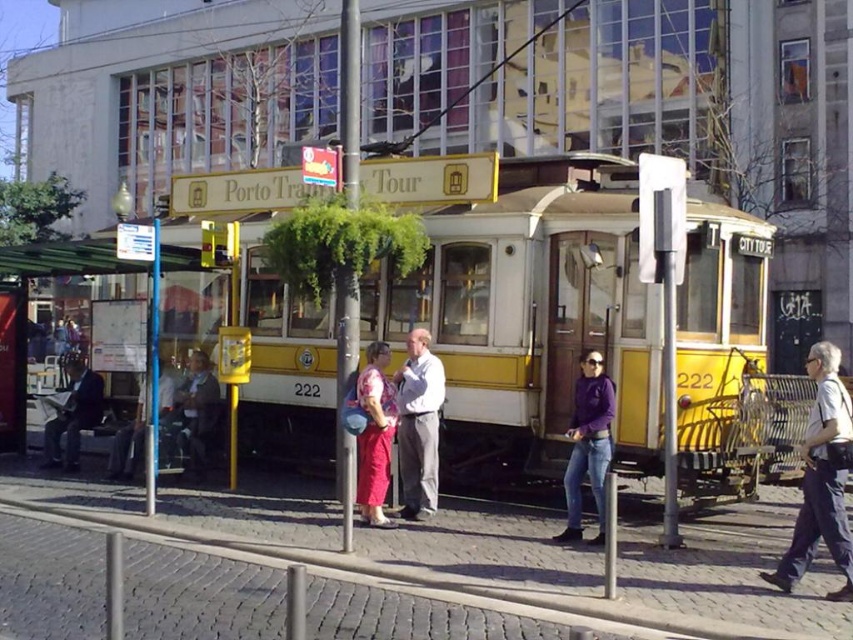
Question: Can you confirm if white plastic bench at left is positioned to the right of purple matte jacket at center?

Choices:
 (A) yes
 (B) no

Answer: (B)

Question: Does yellow matte cable car at center have a smaller size compared to light brown leather jacket at center?

Choices:
 (A) no
 (B) yes

Answer: (B)

Question: Which point is farther to the camera?

Choices:
 (A) (422, 429)
 (B) (572, 508)
 (C) (202, 412)

Answer: (C)

Question: Which point is farther to the camera?

Choices:
 (A) (128, 436)
 (B) (96, 256)

Answer: (A)

Question: Which object is farther from the camera taking this photo?

Choices:
 (A) dark brown leather jacket at left
 (B) yellow matte cable car at center
 (C) purple matte jacket at center

Answer: (A)

Question: Is matte pink dress at center above dark brown leather jacket at left?

Choices:
 (A) yes
 (B) no

Answer: (B)